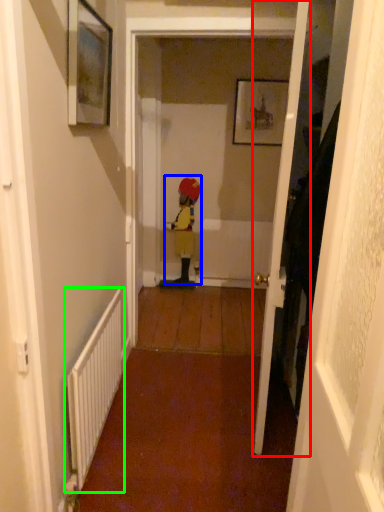
Question: Estimate the real-world distances between objects in this image. Which object is farther from door (highlighted by a red box), person (highlighted by a blue box) or radiator (highlighted by a green box)?

Choices:
 (A) person
 (B) radiator

Answer: (A)